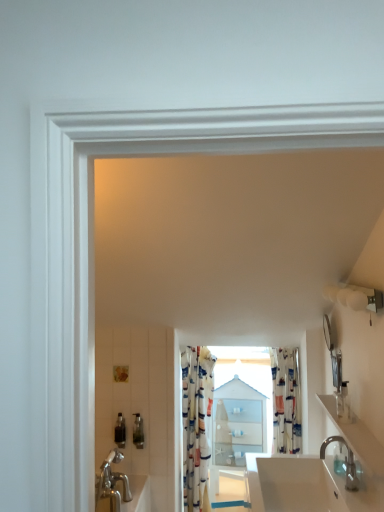
Question: Is white glossy countertop at lower right surrounded by silver metallic faucet at lower right?

Choices:
 (A) no
 (B) yes

Answer: (A)

Question: Can you confirm if silver metallic faucet at lower right is thinner than white glossy countertop at lower right?

Choices:
 (A) yes
 (B) no

Answer: (B)

Question: Are silver metallic faucet at lower right and white glossy countertop at lower right far apart?

Choices:
 (A) no
 (B) yes

Answer: (A)

Question: From the image's perspective, would you say silver metallic faucet at lower right is shown under white glossy countertop at lower right?

Choices:
 (A) yes
 (B) no

Answer: (A)

Question: Is silver metallic faucet at lower right shorter than white glossy countertop at lower right?

Choices:
 (A) no
 (B) yes

Answer: (A)

Question: In terms of size, does white glossy sink at lower center appear bigger or smaller than silver metallic faucet at lower right?

Choices:
 (A) small
 (B) big

Answer: (B)

Question: From a real-world perspective, is white glossy sink at lower center above or below silver metallic faucet at lower right?

Choices:
 (A) below
 (B) above

Answer: (A)

Question: Considering the positions of white glossy sink at lower center and silver metallic faucet at lower right in the image, is white glossy sink at lower center taller or shorter than silver metallic faucet at lower right?

Choices:
 (A) short
 (B) tall

Answer: (A)

Question: Is point (266, 467) positioned closer to the camera than point (347, 461)?

Choices:
 (A) farther
 (B) closer

Answer: (A)

Question: Visually, is silver metallic faucet at lower right positioned to the left or to the right of white glossy sink at lower center?

Choices:
 (A) right
 (B) left

Answer: (A)

Question: Is silver metallic faucet at lower right in front of or behind white glossy sink at lower center in the image?

Choices:
 (A) front
 (B) behind

Answer: (B)

Question: Do you think silver metallic faucet at lower right is within white glossy sink at lower center, or outside of it?

Choices:
 (A) outside
 (B) inside

Answer: (A)

Question: Considering the positions of silver metallic faucet at lower right and white glossy sink at lower center in the image, is silver metallic faucet at lower right bigger or smaller than white glossy sink at lower center?

Choices:
 (A) small
 (B) big

Answer: (A)

Question: Is silver metallic faucet at lower right to the left or to the right of translucent plastic soap dispenser at lower left, which is counted as the first toiletry, starting from the bottom, in the image?

Choices:
 (A) right
 (B) left

Answer: (A)

Question: Is silver metallic faucet at lower right spatially inside translucent plastic soap dispenser at lower left, positioned as the 1th toiletry in left-to-right order, or outside of it?

Choices:
 (A) outside
 (B) inside

Answer: (A)